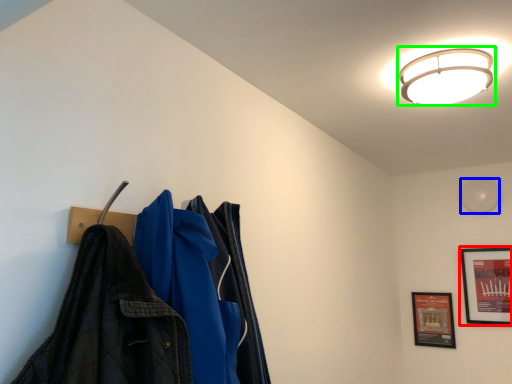
Question: Which object is the closest to the picture frame (highlighted by a red box)? Choose among these: light (highlighted by a blue box) or lamp (highlighted by a green box).

Choices:
 (A) light
 (B) lamp

Answer: (A)